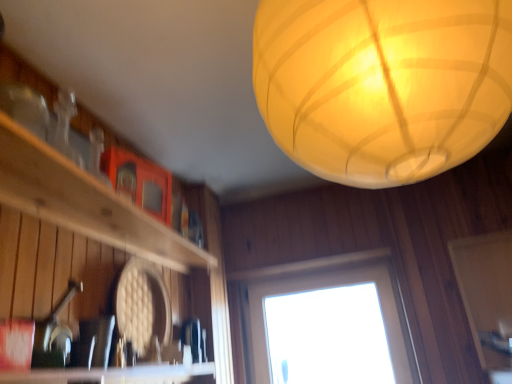
Question: Considering the relative positions of wooden shelf at left and white matte screen door at lower right in the image provided, is wooden shelf at left to the right of white matte screen door at lower right from the viewer's perspective?

Choices:
 (A) yes
 (B) no

Answer: (B)

Question: Is wooden shelf at left bigger than white matte screen door at lower right?

Choices:
 (A) yes
 (B) no

Answer: (B)

Question: Can you confirm if wooden shelf at left is shorter than white matte screen door at lower right?

Choices:
 (A) no
 (B) yes

Answer: (B)

Question: Does wooden shelf at left contain white matte screen door at lower right?

Choices:
 (A) no
 (B) yes

Answer: (A)

Question: Is wooden shelf at left positioned before white matte screen door at lower right?

Choices:
 (A) yes
 (B) no

Answer: (A)

Question: Is wooden shelf at left wider than white matte screen door at lower right?

Choices:
 (A) yes
 (B) no

Answer: (A)

Question: Does white matte screen door at lower right have a lesser height compared to transparent glass window at center?

Choices:
 (A) yes
 (B) no

Answer: (A)

Question: Is white matte screen door at lower right placed right next to transparent glass window at center?

Choices:
 (A) yes
 (B) no

Answer: (B)

Question: Is transparent glass window at center located within white matte screen door at lower right?

Choices:
 (A) yes
 (B) no

Answer: (B)

Question: From the image's perspective, is white matte screen door at lower right above transparent glass window at center?

Choices:
 (A) no
 (B) yes

Answer: (B)

Question: Is white matte screen door at lower right facing away from transparent glass window at center?

Choices:
 (A) no
 (B) yes

Answer: (A)

Question: Does white matte screen door at lower right have a greater width compared to transparent glass window at center?

Choices:
 (A) no
 (B) yes

Answer: (B)

Question: Does translucent paper lantern at upper center have a larger size compared to transparent glass window at center?

Choices:
 (A) no
 (B) yes

Answer: (B)